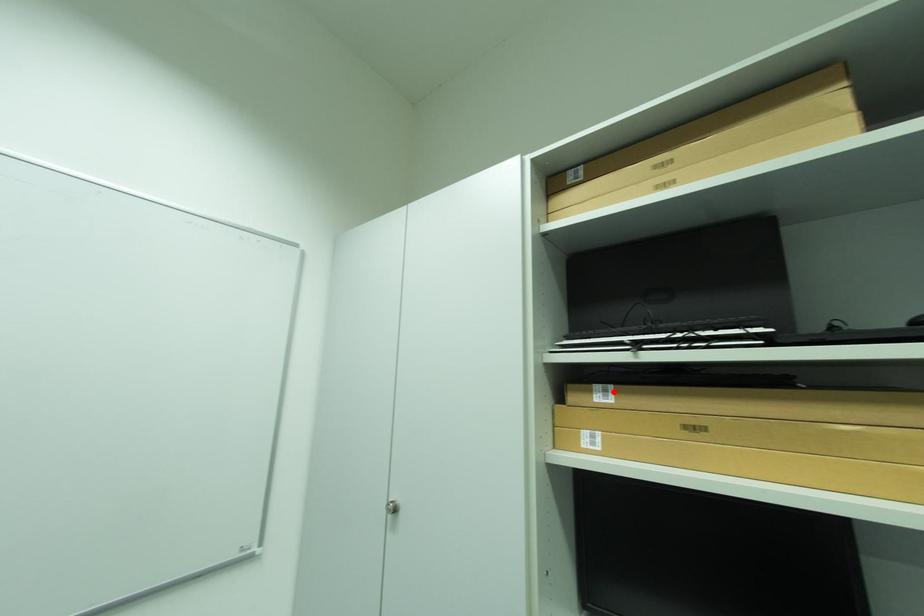
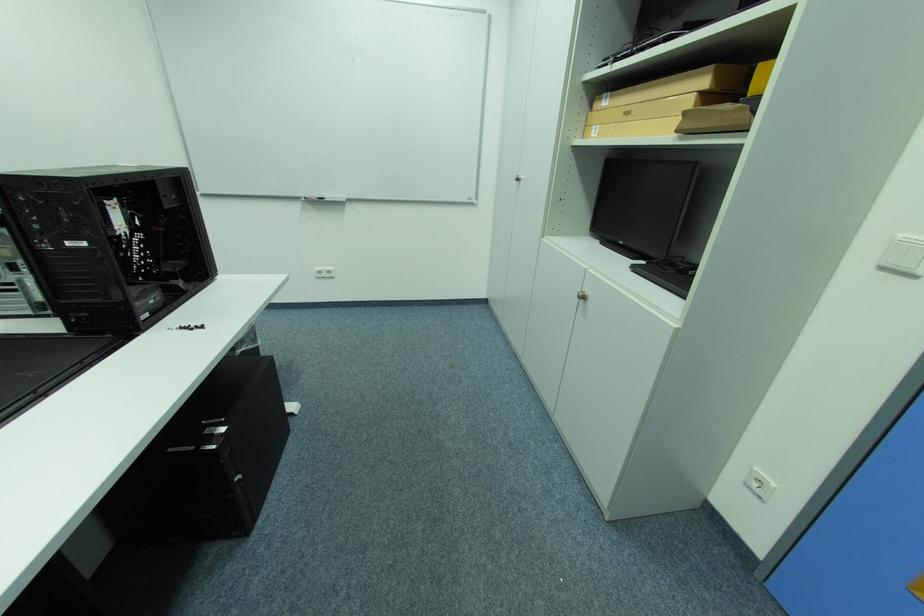
Where in the second image is the point corresponding to the highlighted location from the first image?

(614, 98)